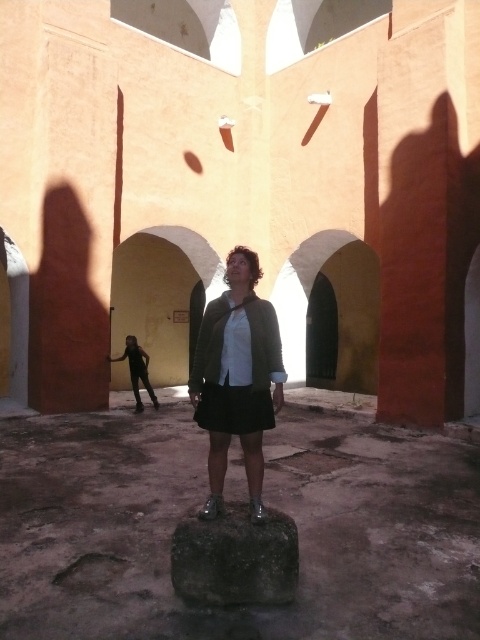
Question: Is dark gray stone at center below black fabric pants at lower left?

Choices:
 (A) no
 (B) yes

Answer: (B)

Question: Which object is the farthest from the smooth stone at center?

Choices:
 (A) matte black skirt at center
 (B) dark gray stone at center

Answer: (A)

Question: Can you confirm if smooth stone at center is smaller than dark gray stone at center?

Choices:
 (A) no
 (B) yes

Answer: (B)

Question: Which of the following is the farthest from the observer?

Choices:
 (A) dark gray stone at center
 (B) matte black skirt at center

Answer: (B)

Question: Which object appears closest to the camera in this image?

Choices:
 (A) smooth stone at center
 (B) black fabric pants at lower left
 (C) matte black skirt at center
 (D) dark gray stone at center

Answer: (D)

Question: Is matte black skirt at center above black fabric pants at lower left?

Choices:
 (A) yes
 (B) no

Answer: (A)